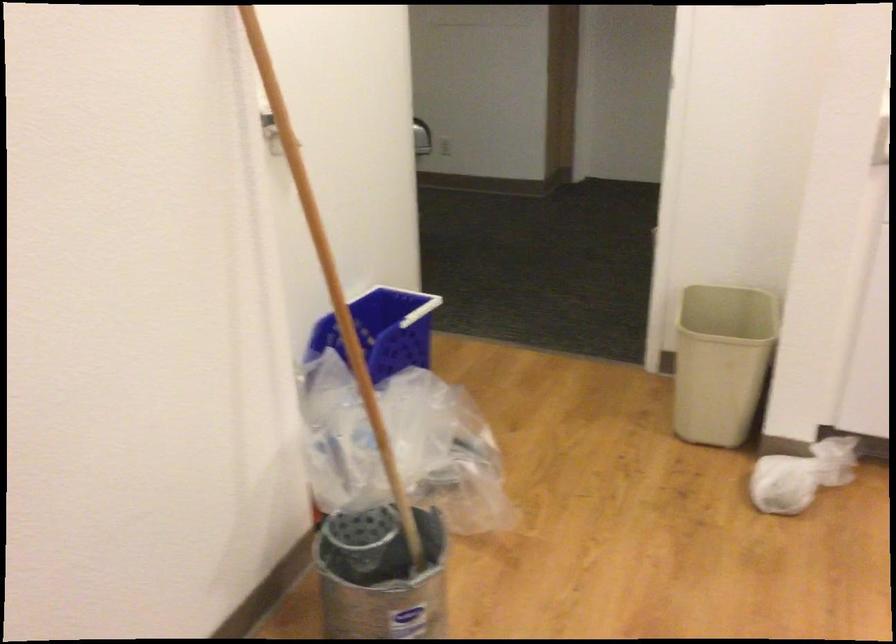
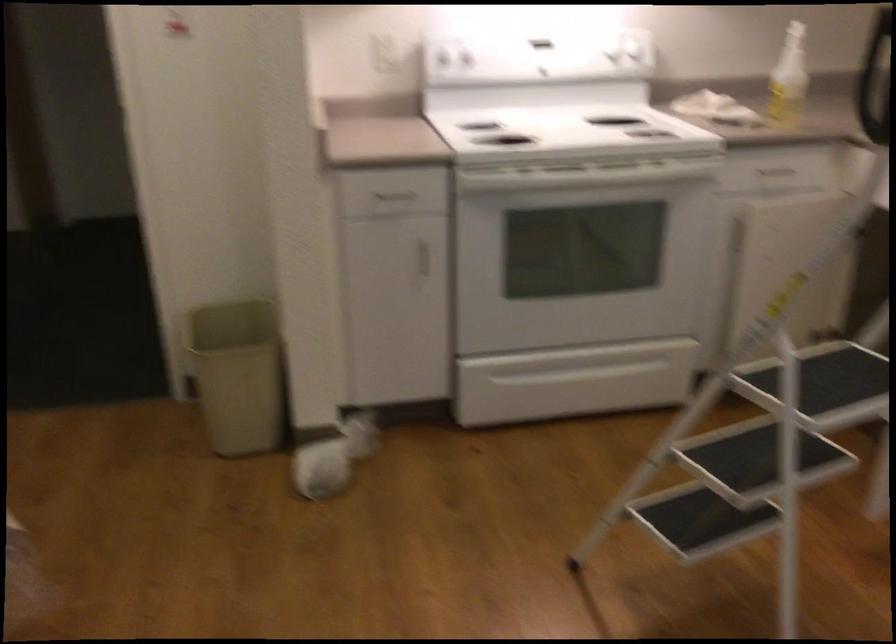
Question: The camera is either moving clockwise (left) or counter-clockwise (right) around the object. The first image is from the beginning of the video and the second image is from the end. Is the camera moving left or right when shooting the video?

Choices:
 (A) Left
 (B) Right

Answer: (A)